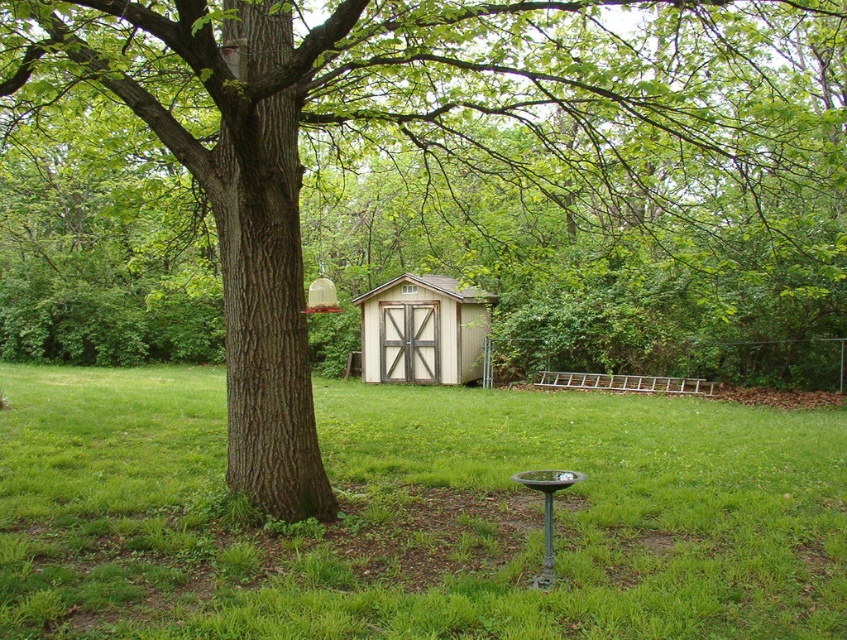
Is green grass at center shorter than light brown wooden shed at center?

Yes.

Between green grass at center and light brown wooden shed at center, which one has more height?

Standing taller between the two is light brown wooden shed at center.

This screenshot has width=847, height=640. What are the coordinates of `green grass at center` in the screenshot? It's located at (418, 515).